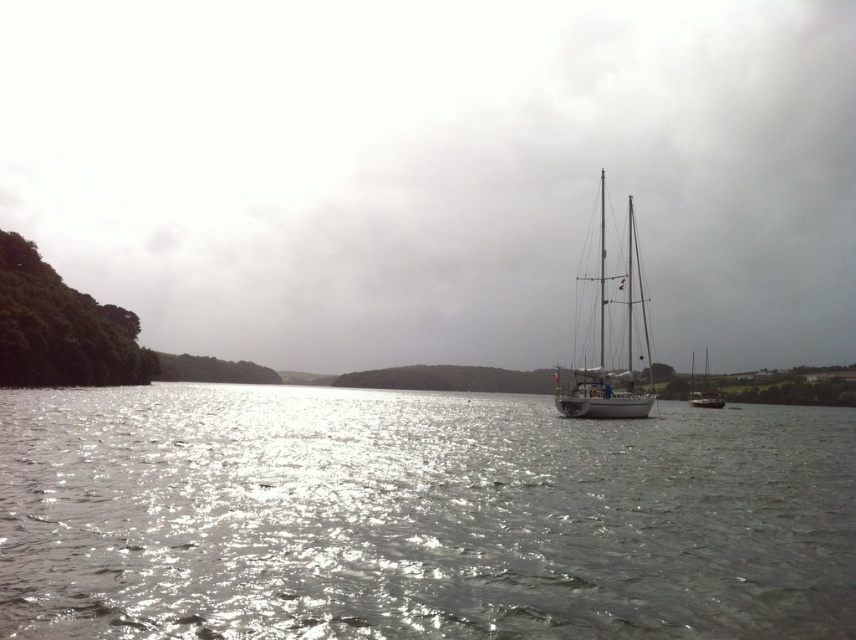
Between glistening silver water at center and white glossy sailboat at center, which one is positioned lower?

glistening silver water at center

Is point (810, 586) positioned behind point (607, 417)?

No, (810, 586) is in front of (607, 417).

Who is more distant from viewer, [642,528] or [566,394]?

The point [566,394] is more distant.

This screenshot has height=640, width=856. I want to click on glistening silver water at center, so pos(417,516).

Does white glossy sailboat at center have a smaller size compared to white matte sailboat at right?

No, white glossy sailboat at center is not smaller than white matte sailboat at right.

Is white glossy sailboat at center thinner than white matte sailboat at right?

Indeed, white glossy sailboat at center has a lesser width compared to white matte sailboat at right.

At what (x,y) coordinates should I click in order to perform the action: click on white glossy sailboat at center. Please return your answer as a coordinate pair (x, y). This screenshot has height=640, width=856. Looking at the image, I should click on (604, 346).

This screenshot has width=856, height=640. Find the location of `white glossy sailboat at center`. white glossy sailboat at center is located at coordinates (604, 346).

Is shiny metallic sailboat at center bigger than white glossy sailboat at center?

Correct, shiny metallic sailboat at center is larger in size than white glossy sailboat at center.

Does shiny metallic sailboat at center have a greater height compared to white glossy sailboat at center?

Yes, shiny metallic sailboat at center is taller than white glossy sailboat at center.

Does point (173, 44) come farther from viewer compared to point (590, 276)?

Yes.

This screenshot has height=640, width=856. Find the location of `shiny metallic sailboat at center`. shiny metallic sailboat at center is located at coordinates (437, 170).